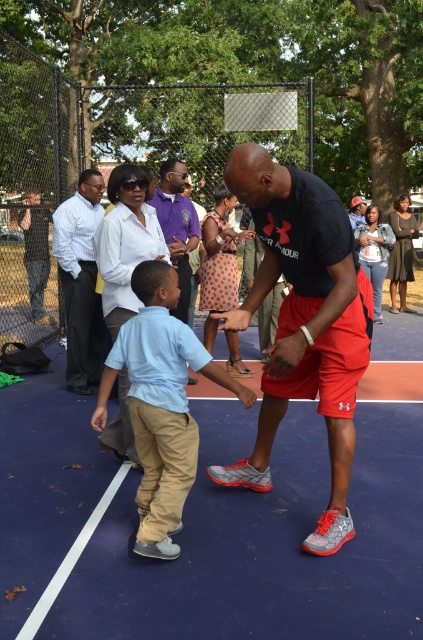
Question: Among these objects, which one is nearest to the camera?

Choices:
 (A) purple cotton polo shirt at upper center
 (B) white shirt at left

Answer: (A)

Question: Is light blue cotton shirt at center to the right of purple cotton polo shirt at upper center from the viewer's perspective?

Choices:
 (A) yes
 (B) no

Answer: (A)

Question: Among these points, which one is farthest from the camera?

Choices:
 (A) (175, 308)
 (B) (156, 276)
 (C) (279, 218)

Answer: (A)

Question: Where is white shirt at left located in relation to purple cotton polo shirt at upper center in the image?

Choices:
 (A) below
 (B) above

Answer: (A)

Question: Is the position of matte black t-shirt at center less distant than that of purple cotton polo shirt at upper center?

Choices:
 (A) yes
 (B) no

Answer: (A)

Question: Which of the following is the farthest from the observer?

Choices:
 (A) (280, 349)
 (B) (140, 378)
 (C) (82, 276)
 (D) (181, 310)

Answer: (D)